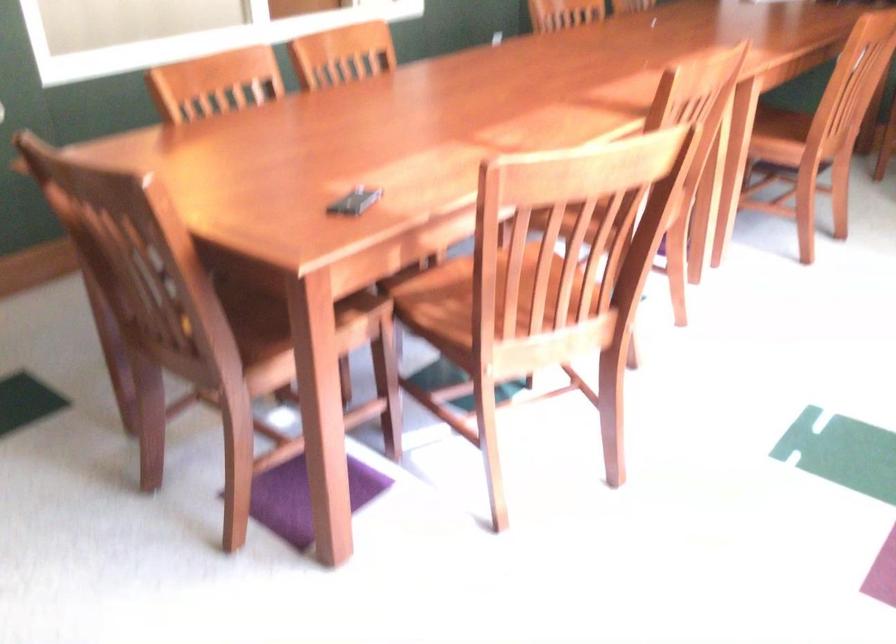
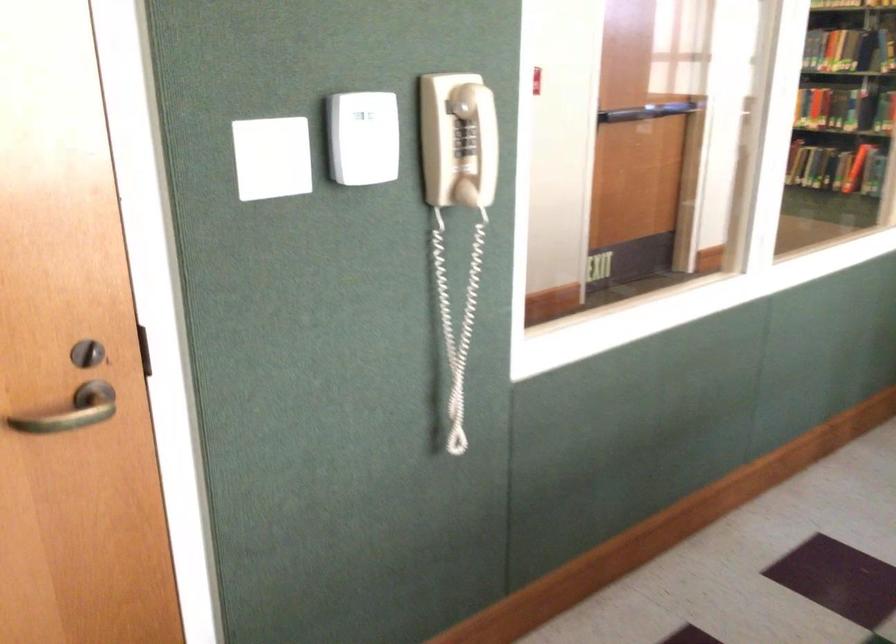
Which direction would the cameraman need to move to produce the second image?

The movement direction of the cameraman is left, forward.